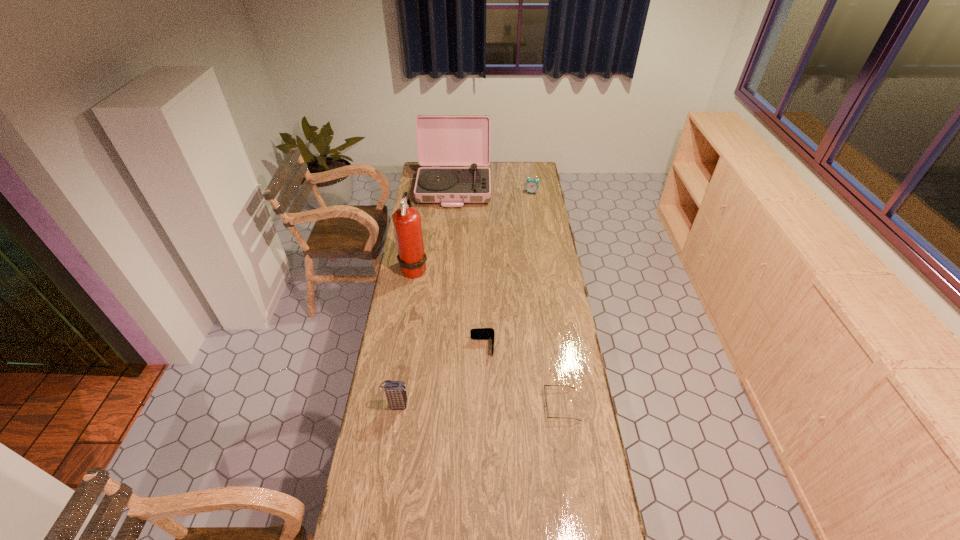
Image resolution: width=960 pixels, height=540 pixels. What are the coordinates of `unoccupied position between the shortest object and the alarm clock` in the screenshot? It's located at (546, 299).

Locate an element on the screen. free area in between the fifth tallest object and the alarm clock is located at coordinates (507, 270).

Locate an element on the screen. blank region between the alarm clock and the fourth farthest object is located at coordinates (507, 270).

Identify the location of vacant region between the second tallest object and the shortest object. (508, 296).

I want to click on free space between the wallet and the fire extinguisher, so click(x=448, y=308).

Find the location of a particular element. The width and height of the screenshot is (960, 540). free space between the fire extinguisher and the alarm clock is located at coordinates (473, 230).

The image size is (960, 540). I want to click on free space between the second tallest object and the fifth tallest object, so click(468, 268).

You are a GUI agent. You are given a task and a screenshot of the screen. Output one action in this format:
    pyautogui.click(x=<x>, y=<y>)
    Task: Click on the unoccupied area between the record player and the alarm clock
    This screenshot has height=540, width=960.
    Given the screenshot: What is the action you would take?
    pyautogui.click(x=492, y=190)

Where is `the fifth closest object to the wallet`? the fifth closest object to the wallet is located at coordinates (532, 185).

Identify the location of object that is the fourth nearest to the tallest object. The width and height of the screenshot is (960, 540). (532, 185).